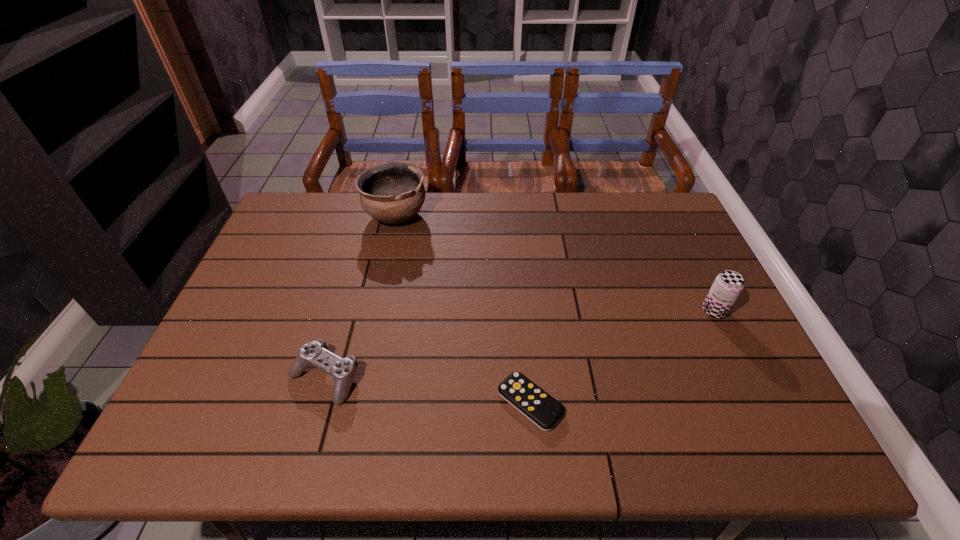
Where is `empty space between the remote control and the second shortest object`? Image resolution: width=960 pixels, height=540 pixels. empty space between the remote control and the second shortest object is located at coordinates (427, 390).

Locate an element on the screen. free space between the remote control and the beer can is located at coordinates (622, 357).

The width and height of the screenshot is (960, 540). What are the coordinates of `empty space between the second shortest object and the shortest object` in the screenshot? It's located at (427, 390).

Locate an element on the screen. unoccupied area between the farthest object and the beer can is located at coordinates (555, 263).

In order to click on free space between the control and the third shortest object in this screenshot , I will do `click(519, 344)`.

Locate an element on the screen. This screenshot has width=960, height=540. free spot between the beer can and the farthest object is located at coordinates (555, 263).

Identify the location of free space between the farthest object and the second object from right to left. (463, 309).

Locate an element on the screen. This screenshot has width=960, height=540. empty space between the shortest object and the rightmost object is located at coordinates (622, 357).

Where is `object that is the third closest to the farthest object`? object that is the third closest to the farthest object is located at coordinates (728, 285).

Select which object is the second closest to the control. Please provide its 2D coordinates. Your answer should be formatted as a tuple, i.e. [(x, y)], where the tuple contains the x and y coordinates of a point satisfying the conditions above.

[(393, 192)]